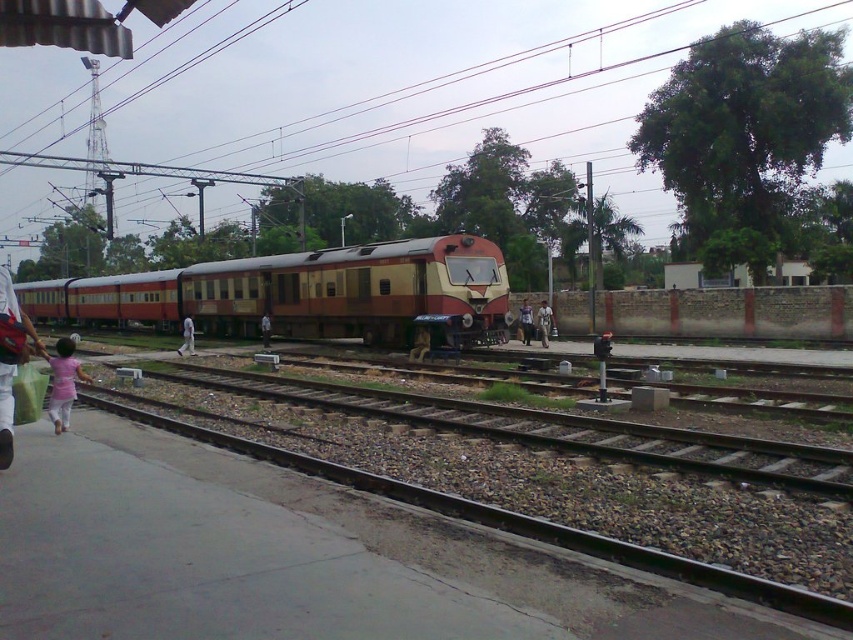
Question: Which is nearer to the smooth brown jacket at center?

Choices:
 (A) matte brown train at center
 (B) brown gravel track at center
 (C) white fabric person at center

Answer: (C)

Question: In this image, where is metallic wires at upper center located relative to matte brown train at center?

Choices:
 (A) above
 (B) below

Answer: (A)

Question: Which point appears farthest from the camera in this image?

Choices:
 (A) [546, 301]
 (B) [190, 323]

Answer: (A)

Question: Which point appears closest to the camera in this image?

Choices:
 (A) (415, 330)
 (B) (260, 332)
 (C) (548, 308)

Answer: (A)

Question: Is matte brown train at center smaller than white fabric person at center?

Choices:
 (A) yes
 (B) no

Answer: (B)

Question: Does pink fabric child at lower left appear on the right side of light brown fabric shirt at center?

Choices:
 (A) no
 (B) yes

Answer: (A)